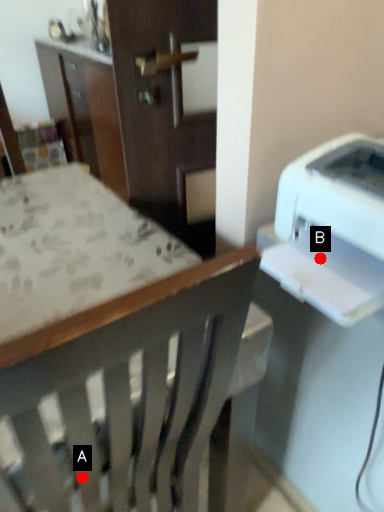
Question: Two points are circled on the image, labeled by A and B beside each circle. Among these points, which one is nearest to the camera?

Choices:
 (A) A is closer
 (B) B is closer

Answer: (A)